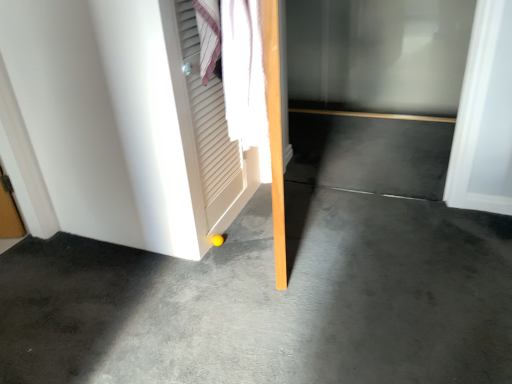
Question: Is matte white door at lower left far away from gray concrete at center?

Choices:
 (A) no
 (B) yes

Answer: (A)

Question: Is matte white door at lower left positioned beyond the bounds of gray concrete at center?

Choices:
 (A) no
 (B) yes

Answer: (B)

Question: From a real-world perspective, is matte white door at lower left physically below gray concrete at center?

Choices:
 (A) yes
 (B) no

Answer: (B)

Question: Does matte white door at lower left have a larger size compared to gray concrete at center?

Choices:
 (A) no
 (B) yes

Answer: (B)

Question: Is matte white door at lower left to the left of gray concrete at center from the viewer's perspective?

Choices:
 (A) no
 (B) yes

Answer: (B)

Question: Is matte white door at lower left at the right side of gray concrete at center?

Choices:
 (A) yes
 (B) no

Answer: (B)

Question: Is white louvered screen door at upper left further to camera compared to transparent glass door at center?

Choices:
 (A) yes
 (B) no

Answer: (B)

Question: Considering the relative sizes of white louvered screen door at upper left and transparent glass door at center in the image provided, is white louvered screen door at upper left thinner than transparent glass door at center?

Choices:
 (A) yes
 (B) no

Answer: (B)

Question: Does white louvered screen door at upper left appear on the left side of transparent glass door at center?

Choices:
 (A) yes
 (B) no

Answer: (A)

Question: From a real-world perspective, is white louvered screen door at upper left physically below transparent glass door at center?

Choices:
 (A) yes
 (B) no

Answer: (B)

Question: From the image's perspective, is white louvered screen door at upper left above transparent glass door at center?

Choices:
 (A) no
 (B) yes

Answer: (A)

Question: From the image's perspective, is white louvered screen door at upper left under transparent glass door at center?

Choices:
 (A) no
 (B) yes

Answer: (B)

Question: Is transparent glass door at center inside matte white door at lower left?

Choices:
 (A) no
 (B) yes

Answer: (A)